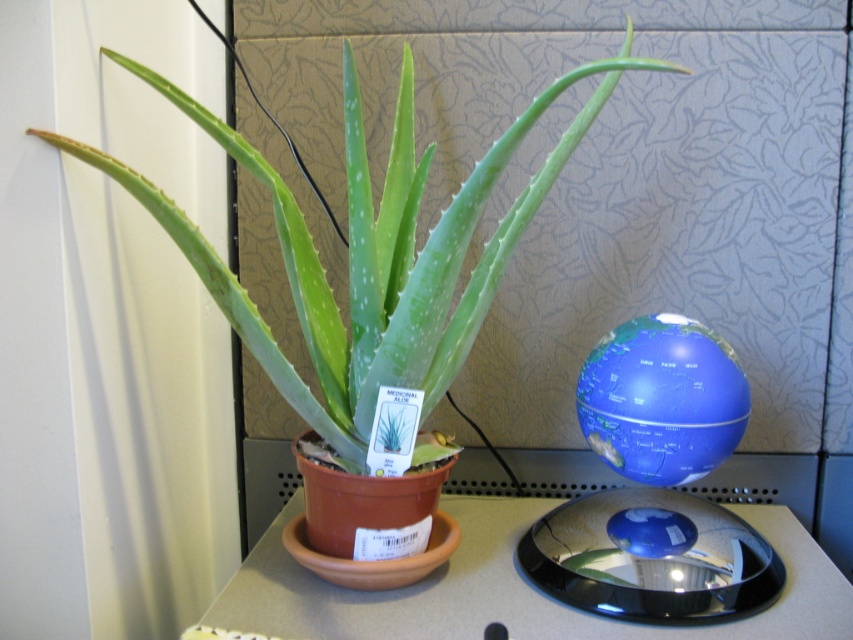
Is green matte/aquarium glass plant at left positioned in front of smooth gray table at center?

Yes.

Does green matte/aquarium glass plant at left appear on the right side of smooth gray table at center?

In fact, green matte/aquarium glass plant at left is to the left of smooth gray table at center.

Is point (415, 173) in front of point (257, 596)?

No.

This screenshot has height=640, width=853. I want to click on green matte/aquarium glass plant at left, so click(x=369, y=257).